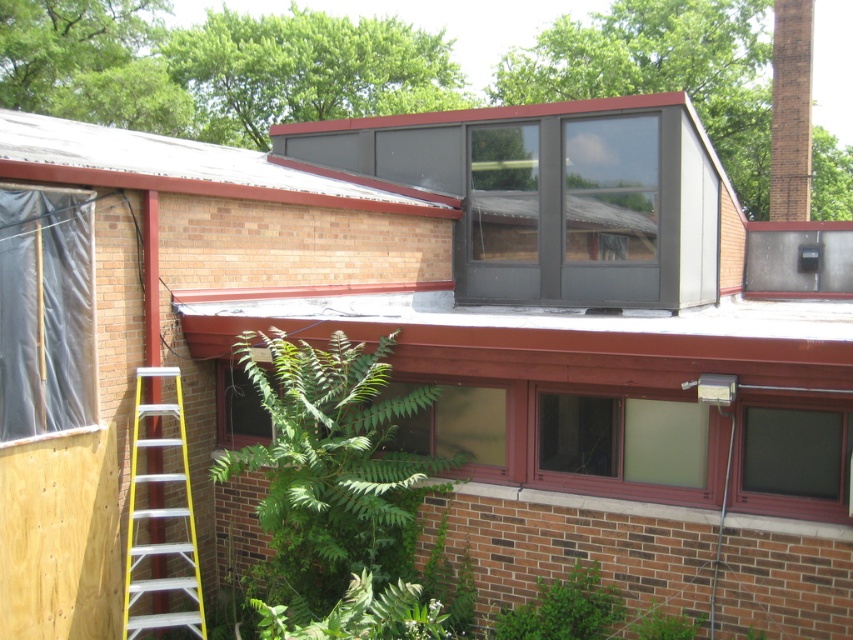
In the scene shown: Does transparent glass window at center have a lesser width compared to green leafy plant at lower right?

No.

Between transparent glass window at center and green leafy plant at lower right, which one has less height?

Standing shorter between the two is green leafy plant at lower right.

Is point (456, 394) less distant than point (653, 637)?

No, it is behind (653, 637).

The width and height of the screenshot is (853, 640). Find the location of `transparent glass window at center`. transparent glass window at center is located at coordinates [457, 426].

Is black plastic tarp at left thinner than clear glass window at center?

Yes.

Is point (93, 348) positioned after point (706, 410)?

That is True.

This screenshot has height=640, width=853. I want to click on black plastic tarp at left, so click(x=45, y=310).

From the picture: Between black plastic tarp at left and green leafy plant at lower center, which one appears on the right side from the viewer's perspective?

From the viewer's perspective, green leafy plant at lower center appears more on the right side.

At what (x,y) coordinates should I click in order to perform the action: click on black plastic tarp at left. Please return your answer as a coordinate pair (x, y). Image resolution: width=853 pixels, height=640 pixels. Looking at the image, I should click on (45, 310).

At what (x,y) coordinates should I click in order to perform the action: click on black plastic tarp at left. Please return your answer as a coordinate pair (x, y). Looking at the image, I should click on (45, 310).